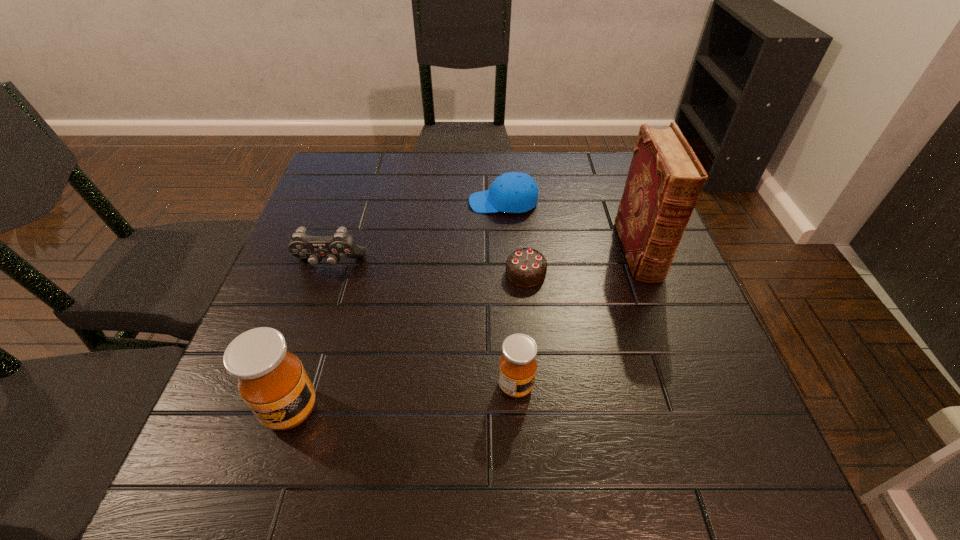
This screenshot has width=960, height=540. In order to click on vacant area situated 0.190m on the right of the shortest object in this screenshot , I will do `click(629, 273)`.

What are the coordinates of `vacant space located on the front-facing side of the farthest object` in the screenshot? It's located at (388, 202).

The width and height of the screenshot is (960, 540). I want to click on free space located 0.310m on the front-facing side of the farthest object, so click(x=354, y=202).

Identify the location of vacant region located 0.270m on the front-facing side of the farthest object. (370, 202).

I want to click on vacant space located on the surface of the control with buttons, so click(319, 298).

The width and height of the screenshot is (960, 540). I want to click on vacant position located on the spine side of the hardback book, so click(675, 348).

Where is `object that is at the far edge`? This screenshot has width=960, height=540. object that is at the far edge is located at coordinates (514, 192).

Find the location of `honey that is at the left edge`. honey that is at the left edge is located at coordinates (272, 381).

You are a GUI agent. You are given a task and a screenshot of the screen. Output one action in this format:
    pyautogui.click(x=<x>, y=<y>)
    Task: Click on the control situated at the left edge
    The width and height of the screenshot is (960, 540).
    Given the screenshot: What is the action you would take?
    pyautogui.click(x=342, y=245)

Find the location of a particular element. The width and height of the screenshot is (960, 540). object that is positioned at the right edge is located at coordinates 665,179.